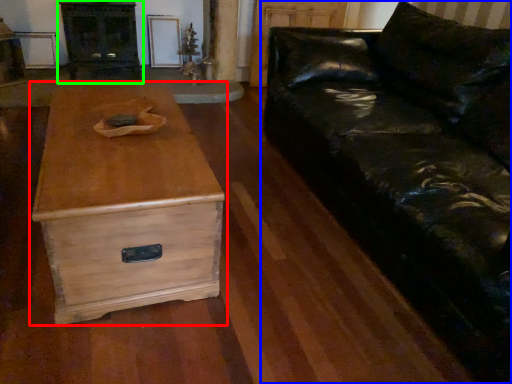
Question: Considering the real-world distances, which object is farthest from chest of drawers (highlighted by a red box)? studio couch (highlighted by a blue box) or entertainment center (highlighted by a green box)?

Choices:
 (A) studio couch
 (B) entertainment center

Answer: (B)